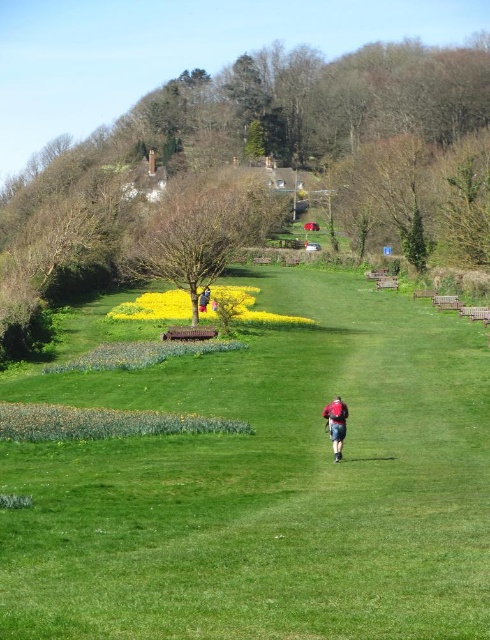
You are planning to plant a new tree in the park. The green leafy tree at center and the bare wood tree at center are already present. Which tree would cast a larger shadow during the summer afternoon when the sun is high?

The green leafy tree at center is taller than the bare wood tree at center, so it would cast a larger shadow during the summer afternoon when the sun is high.

You are a photographer trying to capture the yellow matte flower at center in your shot. The green grassy at center is blocking your view. Can you suggest a way to adjust your position to see the flower better?

The green grassy at center is much taller than the yellow matte flower at center, so you should lower your camera angle or move closer to the ground to avoid the obstruction caused by the taller grass.

You are standing in the park and see the green grassy at center and the red fabric shirt at center. Which object is taller?

The green grassy at center is taller than the red fabric shirt at center.